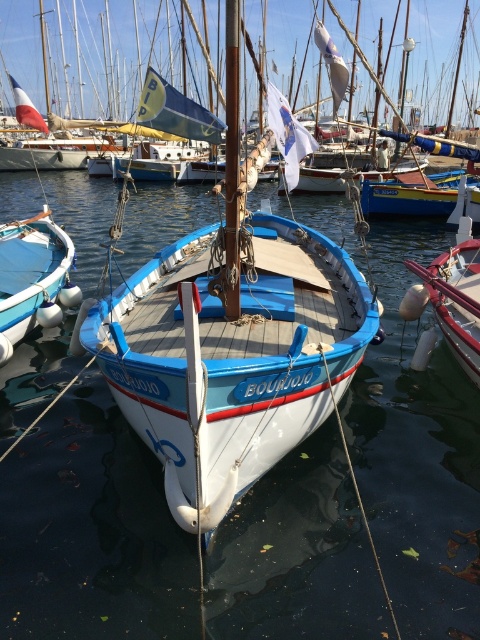
How far apart are white wooden boat at center and white glossy buoy at center?

A distance of 7.17 feet exists between white wooden boat at center and white glossy buoy at center.

Looking at this image, is white wooden boat at center positioned before white glossy buoy at center?

That is True.

Locate an element on the screen. The height and width of the screenshot is (640, 480). white wooden boat at center is located at coordinates (x=231, y=346).

Is clear blue water at center to the left of white glossy buoy at center from the viewer's perspective?

Indeed, clear blue water at center is positioned on the left side of white glossy buoy at center.

Which is in front, point (454, 554) or point (446, 268)?

Point (454, 554) is in front.

Who is more forward, (427,397) or (417,268)?

Point (427,397) is more forward.

I want to click on clear blue water at center, so click(x=92, y=531).

Who is more distant from viewer, (194, 611) or (10, 346)?

The point (10, 346) is more distant.

Is clear blue water at center shorter than white matte boat at left?

No.

Between point (387, 456) and point (26, 221), which one is positioned behind?

Positioned behind is point (26, 221).

The width and height of the screenshot is (480, 640). I want to click on clear blue water at center, so click(x=92, y=531).